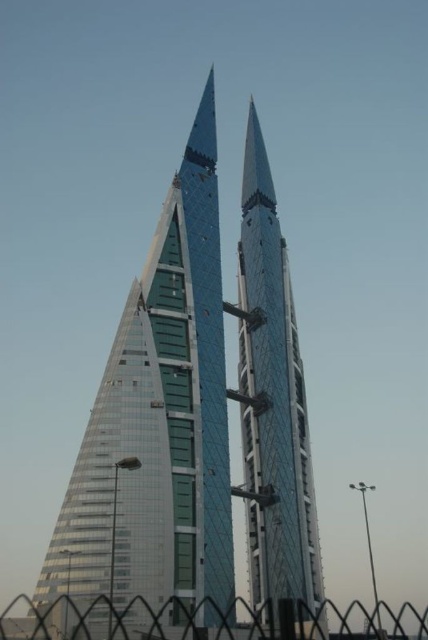
You are an architect evaluating the Bahrain World Trade Center. You notice the glassy steel skyscraper at center and the transparent glass spire at center. Which of these two structures is bigger in terms of overall size?

The glassy steel skyscraper at center is larger in size compared to the transparent glass spire at center.